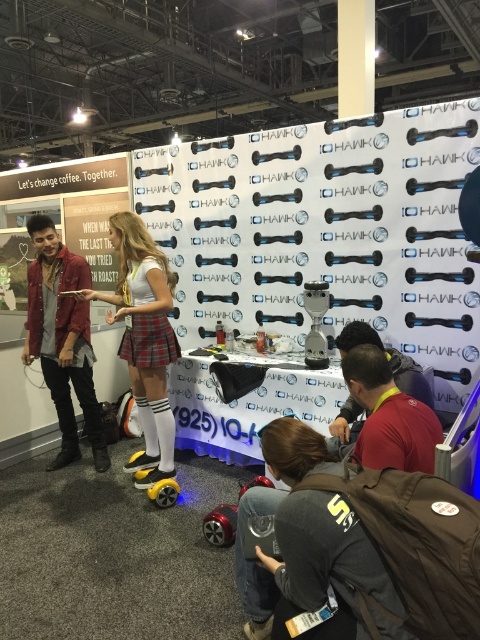
You are at the trade show booth and want to find the matte yellow hoverboard at center. According to the coordinates provided, where exactly is it positioned?

The matte yellow hoverboard at center is located at point coordinates of 0.528 on the x axis and 0.302 on the y axis.